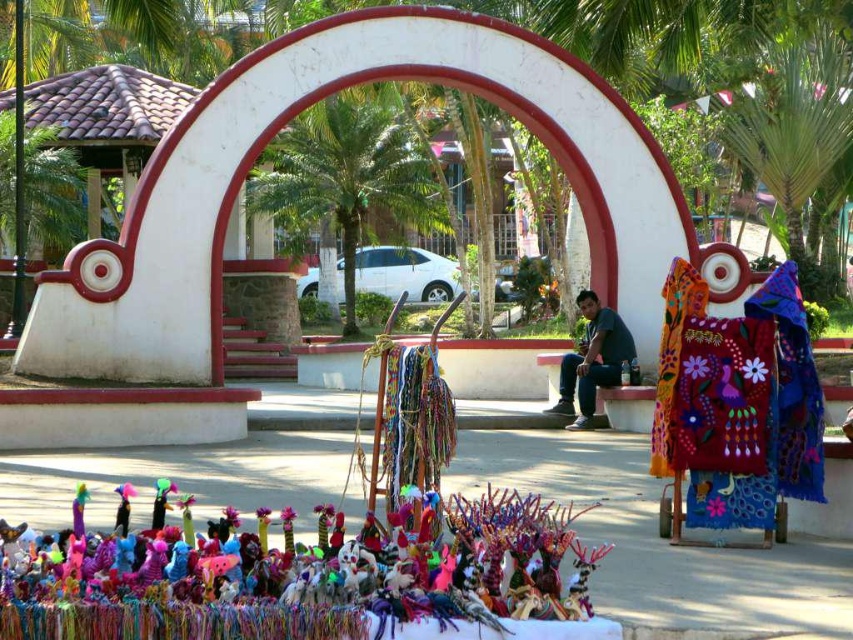
Question: Which point is farther to the camera?

Choices:
 (A) (343, 138)
 (B) (581, 145)
 (C) (619, 356)
 (D) (57, 544)

Answer: (A)

Question: Does green leafy palm tree at center have a lesser width compared to matte black shirt at center?

Choices:
 (A) yes
 (B) no

Answer: (B)

Question: Which point is farther to the camera?

Choices:
 (A) matte black shirt at center
 (B) brightly colored yarn at lower center

Answer: (A)

Question: Among these points, which one is nearest to the camera?

Choices:
 (A) (x=177, y=374)
 (B) (x=831, y=44)

Answer: (A)

Question: Does brightly colored yarn at lower center appear on the left side of matte black shirt at center?

Choices:
 (A) yes
 (B) no

Answer: (A)

Question: Observing the image, what is the correct spatial positioning of brightly colored yarn at lower center in reference to green leafy palm tree at upper right?

Choices:
 (A) left
 (B) right

Answer: (A)